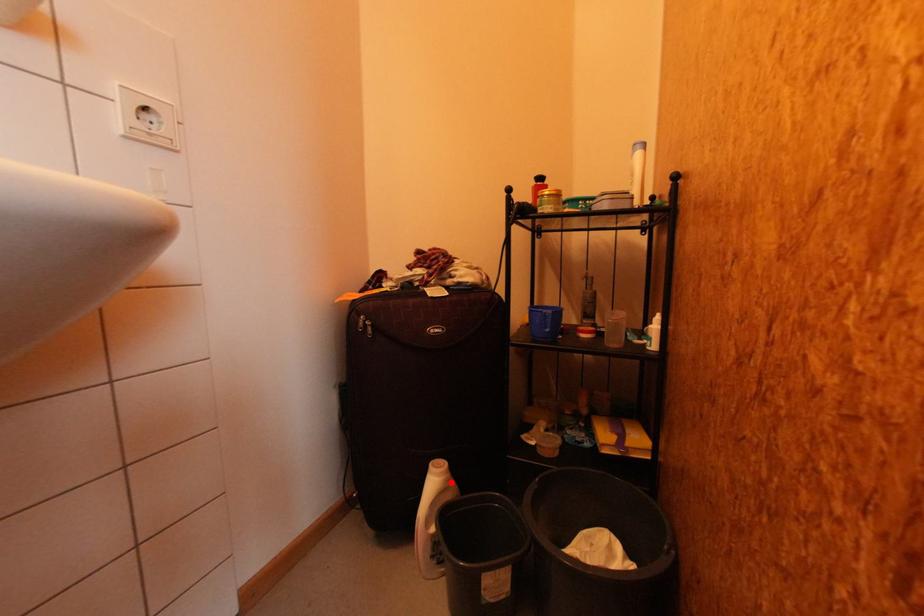
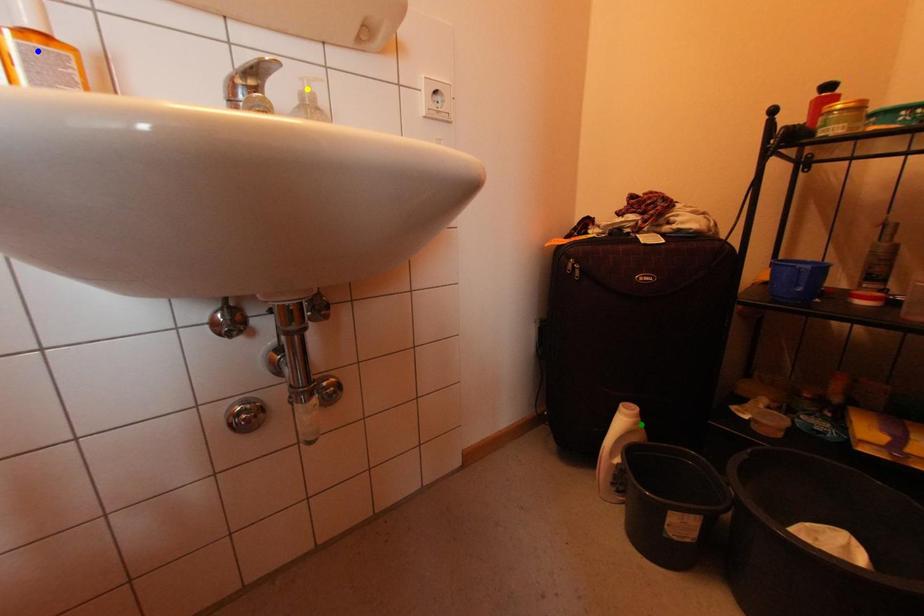
Question: I am providing you with two images of the same scene from different viewpoints. A red point is marked on the first image. You are given multiple points on the second image. Can you choose the point in image 2 that corresponds to the point in image 1?

Choices:
 (A) blue point
 (B) yellow point
 (C) green point

Answer: (C)